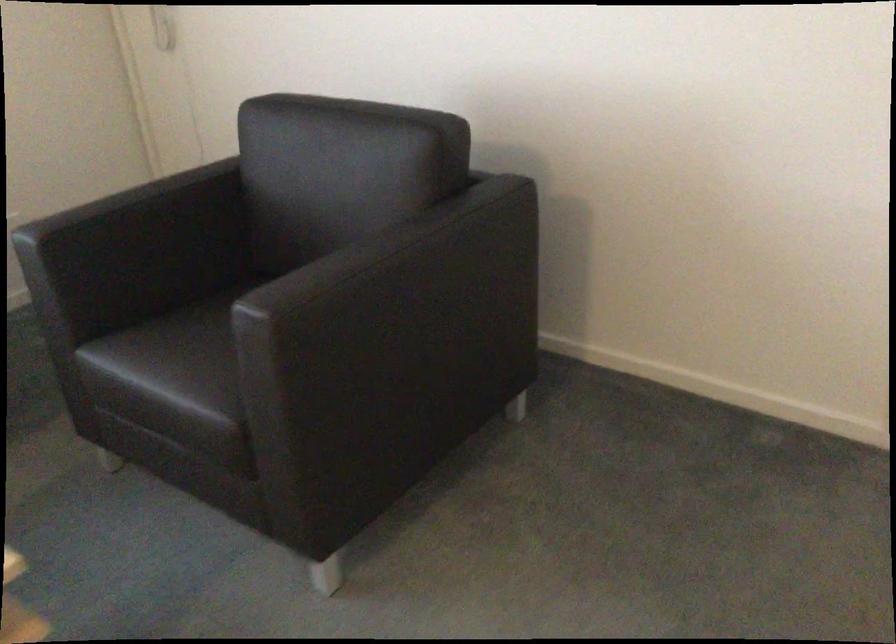
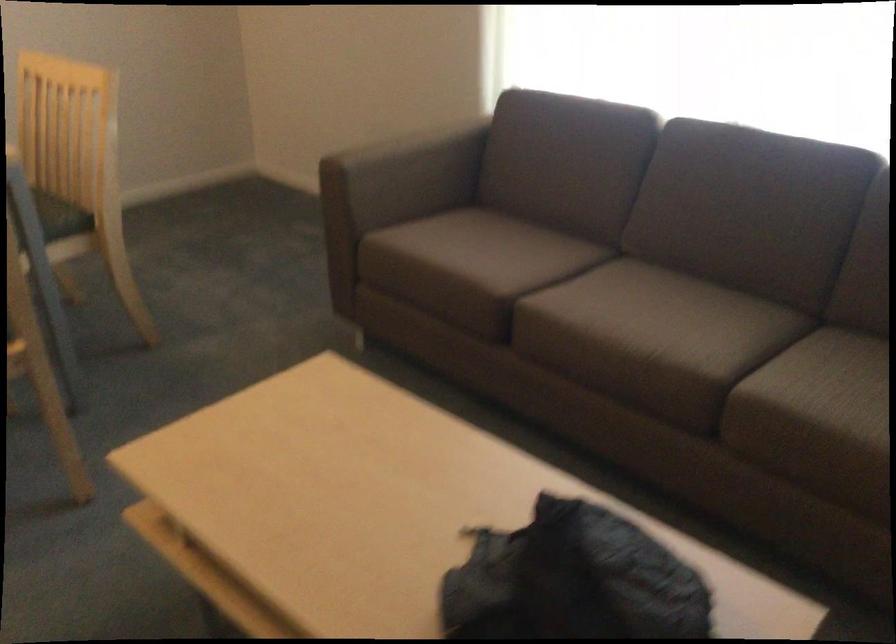
Based on the continuous images, in which direction is the camera rotating?

The camera rotated toward left-down.